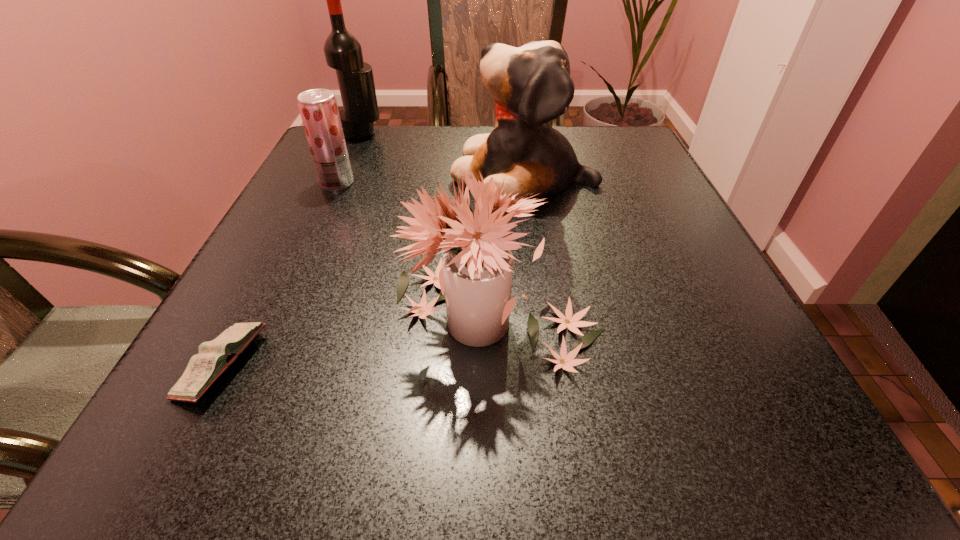
At what (x,y) coordinates should I click in order to perform the action: click on the farthest object. Please return your answer as a coordinate pair (x, y). Looking at the image, I should click on (343, 52).

Locate an element on the screen. The height and width of the screenshot is (540, 960). wine bottle is located at coordinates (343, 52).

Find the location of a particular element. The height and width of the screenshot is (540, 960). puppy is located at coordinates (531, 85).

Identify the location of bouquet. (477, 269).

Identify the location of the fourth tallest object. (318, 108).

You are a GUI agent. You are given a task and a screenshot of the screen. Output one action in this format:
    pyautogui.click(x=<x>, y=<y>)
    Task: Click on the shortest object
    This screenshot has width=960, height=540.
    Given the screenshot: What is the action you would take?
    pyautogui.click(x=215, y=356)

The image size is (960, 540). In order to click on free spot located on the front of the tallest object in this screenshot , I will do `click(331, 203)`.

Image resolution: width=960 pixels, height=540 pixels. I want to click on vacant region located at the face of the puppy, so [375, 176].

The height and width of the screenshot is (540, 960). I want to click on vacant space situated 0.070m at the face of the puppy, so click(421, 176).

Where is `vacant space located at the face of the puppy`? The height and width of the screenshot is (540, 960). vacant space located at the face of the puppy is located at coordinates (304, 176).